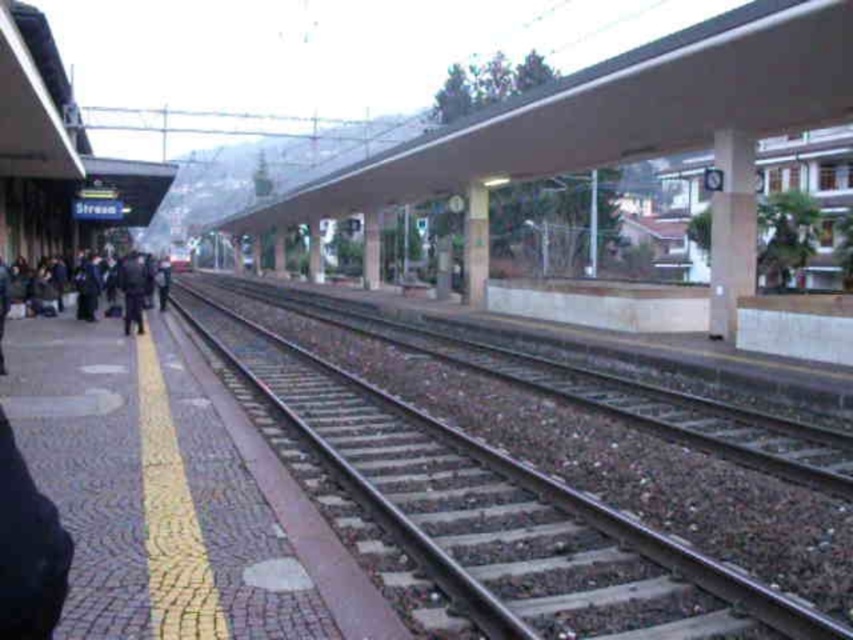
Question: Is concrete pillar at center positioned behind smooth concrete pillar at center?

Choices:
 (A) no
 (B) yes

Answer: (A)

Question: Which point is closer to the camera?

Choices:
 (A) smooth concrete pillar at center
 (B) concrete pillar at center
 (C) dark blue jeans at left
 (D) dark blue uniform at center

Answer: (C)

Question: Which object appears closest to the camera in this image?

Choices:
 (A) dark blue jeans at left
 (B) white concrete pillar at center

Answer: (A)

Question: Can you confirm if concrete pillar at center is wider than white concrete pillar at center?

Choices:
 (A) yes
 (B) no

Answer: (A)

Question: Does dark blue uniform at center have a lesser width compared to white concrete pillar at center?

Choices:
 (A) yes
 (B) no

Answer: (B)

Question: Which of the following is the closest to the observer?

Choices:
 (A) dark blue uniform at center
 (B) concrete pillar at center

Answer: (B)